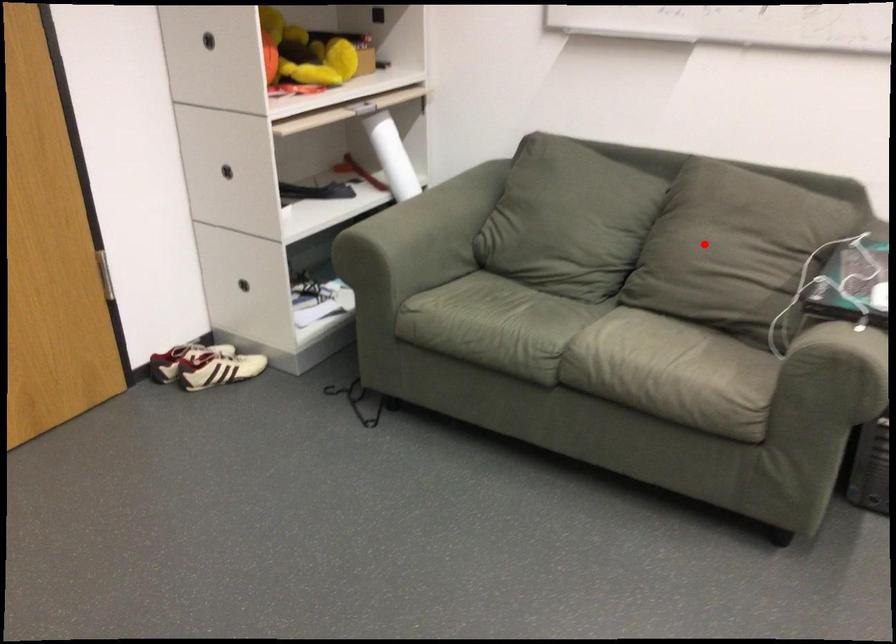
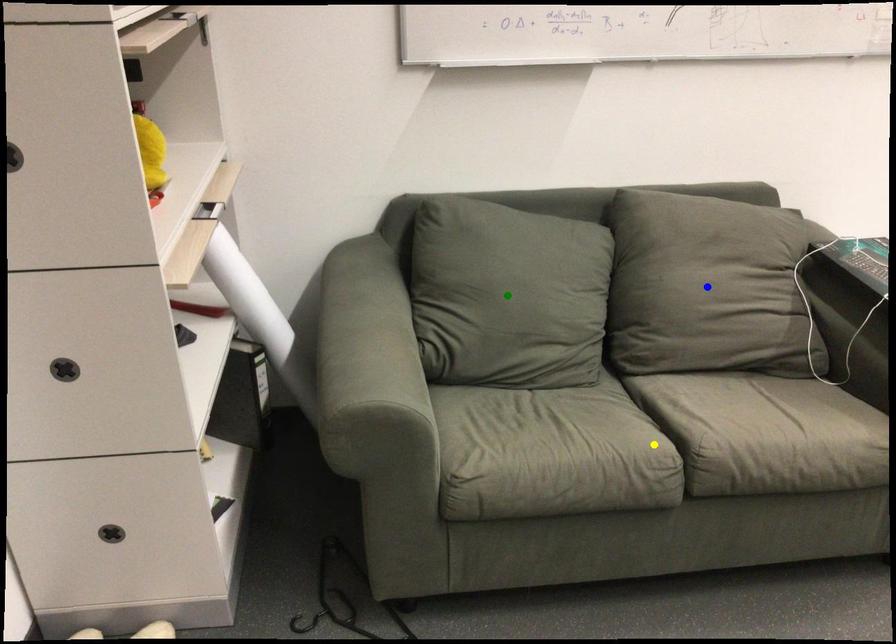
Question: I am providing you with two images of the same scene from different viewpoints. A red point is marked on the first image. You are given multiple points on the second image. Which point in image 2 represents the same 3d spot as the red point in image 1?

Choices:
 (A) yellow point
 (B) blue point
 (C) green point

Answer: (B)